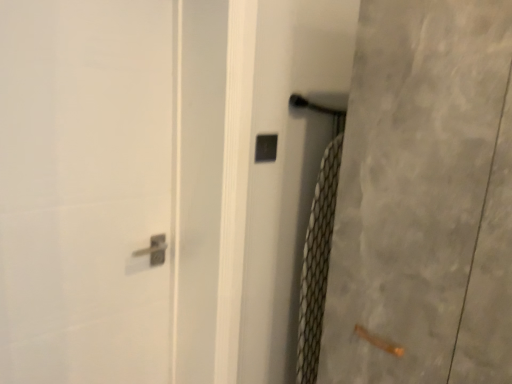
The image size is (512, 384). Describe the element at coordinates (287, 168) in the screenshot. I see `clear plastic screen door at center, the 2th screen door when ordered from left to right` at that location.

Locate an element on the screen. This screenshot has width=512, height=384. black plastic lock at center is located at coordinates (266, 148).

Locate an element on the screen. This screenshot has height=384, width=512. white glossy door handle at upper center, arranged as the first screen door when viewed from the left is located at coordinates (109, 189).

Is clear plastic screen door at center, the 2th screen door when ordered from left to right, oriented towards white glossy door handle at upper center, which is counted as the third screen door, starting from the right?

No, clear plastic screen door at center, the 2th screen door when ordered from left to right, is not oriented towards white glossy door handle at upper center, which is counted as the third screen door, starting from the right.

Is clear plastic screen door at center, the 2th screen door from the right, next to white glossy door handle at upper center, which is counted as the third screen door, starting from the right?

No, clear plastic screen door at center, the 2th screen door from the right, is not touching white glossy door handle at upper center, which is counted as the third screen door, starting from the right.

Based on the photo, is clear plastic screen door at center, the 2th screen door when ordered from left to right, wider or thinner than white glossy door handle at upper center, which is counted as the third screen door, starting from the right?

Considering their sizes, clear plastic screen door at center, the 2th screen door when ordered from left to right, looks slimmer than white glossy door handle at upper center, which is counted as the third screen door, starting from the right.

Can white glossy door handle at upper center, arranged as the first screen door when viewed from the left, be found inside clear plastic screen door at center, the 2th screen door when ordered from left to right?

No, white glossy door handle at upper center, arranged as the first screen door when viewed from the left, is located outside of clear plastic screen door at center, the 2th screen door when ordered from left to right.

Which object is wider, white textured screen door at right, acting as the 3th screen door starting from the left, or black plastic lock at center?

white textured screen door at right, acting as the 3th screen door starting from the left, is wider.

Is white textured screen door at right, the first screen door when ordered from right to left, oriented away from black plastic lock at center?

No, white textured screen door at right, the first screen door when ordered from right to left, is not facing the opposite direction of black plastic lock at center.

In terms of height, does white textured screen door at right, the first screen door when ordered from right to left, look taller or shorter compared to black plastic lock at center?

Answer: white textured screen door at right, the first screen door when ordered from right to left, is taller than black plastic lock at center.

Considering the relative sizes of white textured screen door at right, acting as the 3th screen door starting from the left, and clear plastic screen door at center, the 2th screen door when ordered from left to right, in the image provided, is white textured screen door at right, acting as the 3th screen door starting from the left, wider than clear plastic screen door at center, the 2th screen door when ordered from left to right,?

Indeed, white textured screen door at right, acting as the 3th screen door starting from the left, has a greater width compared to clear plastic screen door at center, the 2th screen door when ordered from left to right.

Is white textured screen door at right, acting as the 3th screen door starting from the left, touching clear plastic screen door at center, the 2th screen door from the right?

No, white textured screen door at right, acting as the 3th screen door starting from the left, is not touching clear plastic screen door at center, the 2th screen door from the right.

Which is less distant, (388, 336) or (272, 361)?

The point (388, 336) is in front.

Is white textured screen door at right, the first screen door when ordered from right to left, in front of or behind clear plastic screen door at center, the 2th screen door from the right, in the image?

Clearly, white textured screen door at right, the first screen door when ordered from right to left, is in front of clear plastic screen door at center, the 2th screen door from the right.

Which of these two, black plastic lock at center or white glossy door handle at upper center, which is counted as the third screen door, starting from the right, stands taller?

white glossy door handle at upper center, which is counted as the third screen door, starting from the right, is taller.

At what (x,y) coordinates should I click in order to perform the action: click on the 1st screen door below the black plastic lock at center (from the image's perspective). Please return your answer as a coordinate pair (x, y). The width and height of the screenshot is (512, 384). Looking at the image, I should click on (109, 189).

What's the angular difference between black plastic lock at center and white glossy door handle at upper center, arranged as the first screen door when viewed from the left,'s facing directions?

There is a 1.97-degree angle between the facing directions of black plastic lock at center and white glossy door handle at upper center, arranged as the first screen door when viewed from the left.

From the image's perspective, between black plastic lock at center and white glossy door handle at upper center, which is counted as the third screen door, starting from the right, who is located below?

white glossy door handle at upper center, which is counted as the third screen door, starting from the right.

Is black plastic lock at center further to camera compared to white textured screen door at right, the first screen door when ordered from right to left?

Yes, black plastic lock at center is further from the viewer.

Based on the photo, is black plastic lock at center looking in the opposite direction of white textured screen door at right, the first screen door when ordered from right to left?

No, black plastic lock at center is not facing the opposite direction of white textured screen door at right, the first screen door when ordered from right to left.

Can we say black plastic lock at center lies outside white textured screen door at right, acting as the 3th screen door starting from the left?

Yes, black plastic lock at center is located beyond the bounds of white textured screen door at right, acting as the 3th screen door starting from the left.

What's the angular difference between white glossy door handle at upper center, which is counted as the third screen door, starting from the right, and clear plastic screen door at center, the 2th screen door when ordered from left to right,'s facing directions?

There is a 3.13-degree angle between the facing directions of white glossy door handle at upper center, which is counted as the third screen door, starting from the right, and clear plastic screen door at center, the 2th screen door when ordered from left to right.

Does point (37, 77) come behind point (291, 304)?

No, it is in front of (291, 304).

Who is taller, white glossy door handle at upper center, which is counted as the third screen door, starting from the right, or clear plastic screen door at center, the 2th screen door when ordered from left to right?

white glossy door handle at upper center, which is counted as the third screen door, starting from the right.

Between white glossy door handle at upper center, which is counted as the third screen door, starting from the right, and clear plastic screen door at center, the 2th screen door from the right, which one has larger width?

white glossy door handle at upper center, which is counted as the third screen door, starting from the right, is wider.

Which is in front, clear plastic screen door at center, the 2th screen door when ordered from left to right, or white textured screen door at right, the first screen door when ordered from right to left?

Positioned in front is white textured screen door at right, the first screen door when ordered from right to left.

Image resolution: width=512 pixels, height=384 pixels. What are the coordinates of `the 2nd screen door behind the white textured screen door at right, the first screen door when ordered from right to left, counting from the anchor's position` in the screenshot? It's located at (287, 168).

Which object is positioned more to the left, clear plastic screen door at center, the 2th screen door from the right, or white textured screen door at right, acting as the 3th screen door starting from the left?

clear plastic screen door at center, the 2th screen door from the right, is more to the left.

From the image's perspective, starting from the clear plastic screen door at center, the 2th screen door when ordered from left to right, which screen door is the 2nd one above? Please provide its 2D coordinates.

[(109, 189)]

Where is `screen door that is the 3rd object located in front of the black plastic lock at center`? The width and height of the screenshot is (512, 384). screen door that is the 3rd object located in front of the black plastic lock at center is located at coordinates (425, 199).

Estimate the real-world distances between objects in this image. Which object is further from clear plastic screen door at center, the 2th screen door when ordered from left to right, black plastic lock at center or white glossy door handle at upper center, which is counted as the third screen door, starting from the right?

white glossy door handle at upper center, which is counted as the third screen door, starting from the right, is further to clear plastic screen door at center, the 2th screen door when ordered from left to right.

Based on the photo, which object lies further to the anchor point black plastic lock at center, white glossy door handle at upper center, arranged as the first screen door when viewed from the left, or white textured screen door at right, acting as the 3th screen door starting from the left?

Among the two, white glossy door handle at upper center, arranged as the first screen door when viewed from the left, is located further to black plastic lock at center.

Which object lies further to the anchor point white glossy door handle at upper center, which is counted as the third screen door, starting from the right, black plastic lock at center or clear plastic screen door at center, the 2th screen door from the right?

black plastic lock at center lies further to white glossy door handle at upper center, which is counted as the third screen door, starting from the right, than the other object.

From the image, which object appears to be nearer to black plastic lock at center, white textured screen door at right, acting as the 3th screen door starting from the left, or white glossy door handle at upper center, arranged as the first screen door when viewed from the left?

white textured screen door at right, acting as the 3th screen door starting from the left.

When comparing their distances from white textured screen door at right, acting as the 3th screen door starting from the left, does clear plastic screen door at center, the 2th screen door from the right, or white glossy door handle at upper center, arranged as the first screen door when viewed from the left, seem closer?

clear plastic screen door at center, the 2th screen door from the right, is closer to white textured screen door at right, acting as the 3th screen door starting from the left.

From the image, which object appears to be farther from white textured screen door at right, acting as the 3th screen door starting from the left, clear plastic screen door at center, the 2th screen door when ordered from left to right, or black plastic lock at center?

black plastic lock at center is positioned further to the anchor white textured screen door at right, acting as the 3th screen door starting from the left.

From the image, which object appears to be nearer to clear plastic screen door at center, the 2th screen door when ordered from left to right, white textured screen door at right, the first screen door when ordered from right to left, or black plastic lock at center?

black plastic lock at center is closer to clear plastic screen door at center, the 2th screen door when ordered from left to right.

Estimate the real-world distances between objects in this image. Which object is further from black plastic lock at center, white textured screen door at right, acting as the 3th screen door starting from the left, or clear plastic screen door at center, the 2th screen door from the right?

The object further to black plastic lock at center is white textured screen door at right, acting as the 3th screen door starting from the left.

Where is `lock between white glossy door handle at upper center, arranged as the first screen door when viewed from the left, and clear plastic screen door at center, the 2th screen door from the right`? The image size is (512, 384). lock between white glossy door handle at upper center, arranged as the first screen door when viewed from the left, and clear plastic screen door at center, the 2th screen door from the right is located at coordinates (266, 148).

Locate an element on the screen. This screenshot has height=384, width=512. screen door located between white glossy door handle at upper center, which is counted as the third screen door, starting from the right, and white textured screen door at right, the first screen door when ordered from right to left, in the left-right direction is located at coordinates pos(287,168).

You are a GUI agent. You are given a task and a screenshot of the screen. Output one action in this format:
    pyautogui.click(x=<x>, y=<y>)
    Task: Click on the lock situated between white glossy door handle at upper center, which is counted as the third screen door, starting from the right, and white textured screen door at right, the first screen door when ordered from right to left, from left to right
    
    Given the screenshot: What is the action you would take?
    pyautogui.click(x=266, y=148)